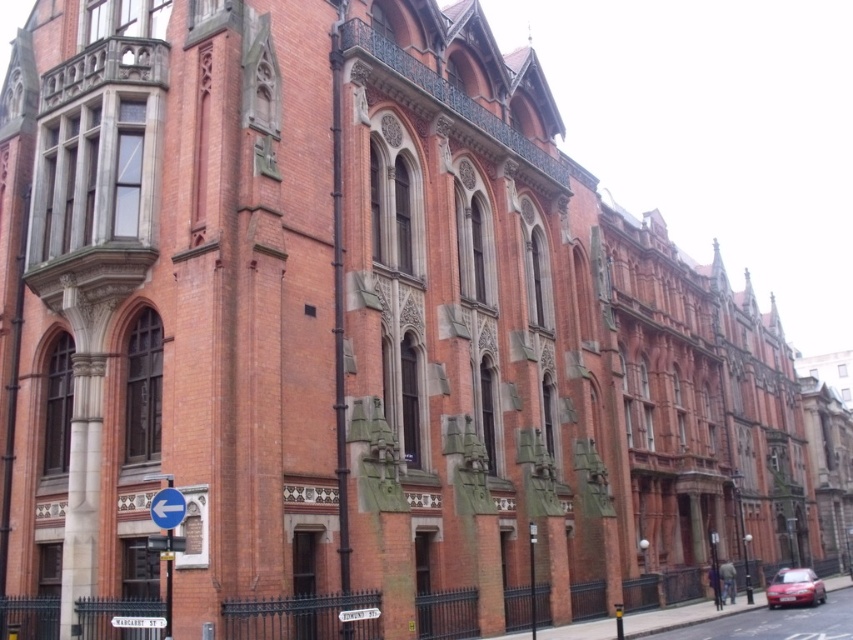
Is point (801, 580) more distant than point (155, 499)?

Yes, it is.

Measure the distance between point (x=788, y=573) and camera.

Point (x=788, y=573) and camera are 82.08 meters apart.

Where is `shiny red car at lower right`? shiny red car at lower right is located at coordinates (795, 588).